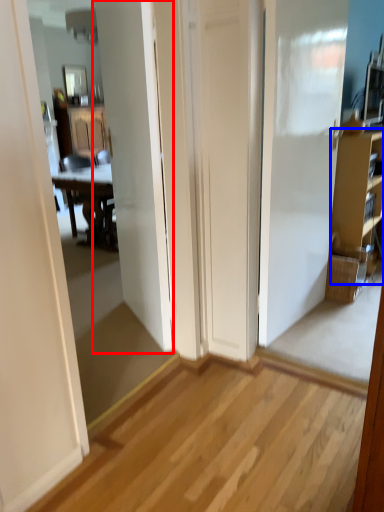
Question: Which object appears farthest to the camera in this image, door (highlighted by a red box) or cabinetry (highlighted by a blue box)?

Choices:
 (A) door
 (B) cabinetry

Answer: (B)